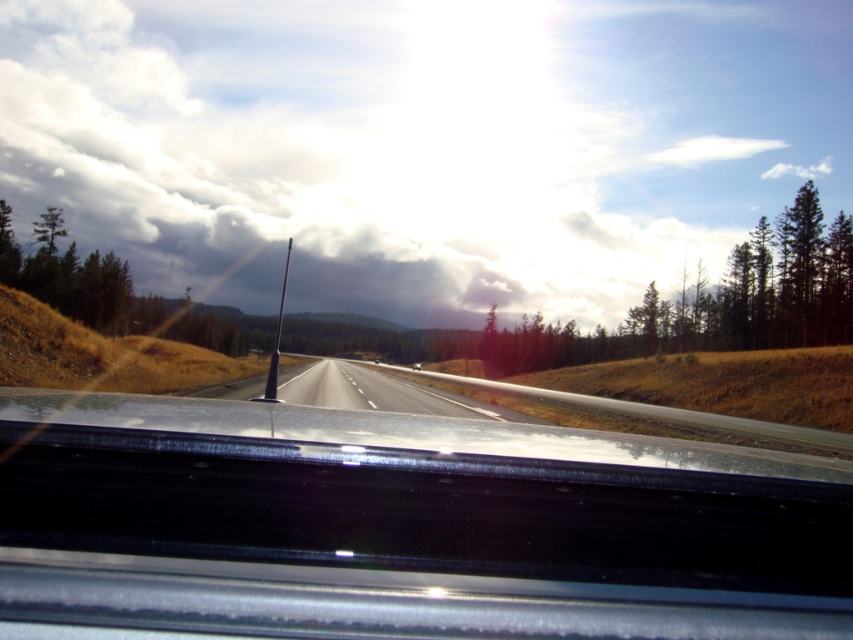
You are driving a car and looking through the windshield. You see the white fluffy cloud at upper center and the asphalt road at center. Which object is closer to you?

The white fluffy cloud at upper center is closer to you because the asphalt road at center is behind it.

You are a passenger in the car and looking out the window. You see the white fluffy cloud at upper center and the asphalt road at center. Which object is located above the other?

The white fluffy cloud at upper center is positioned over asphalt road at center, so the cloud is above the road.

You are a drone operator planning to fly a drone from the white fluffy cloud at upper center to the asphalt road at center. According to the scene, what is the minimum distance you need to cover?

The minimum distance between the white fluffy cloud at upper center and the asphalt road at center is 63.11 meters, so you need to cover at least 63.11 meters.